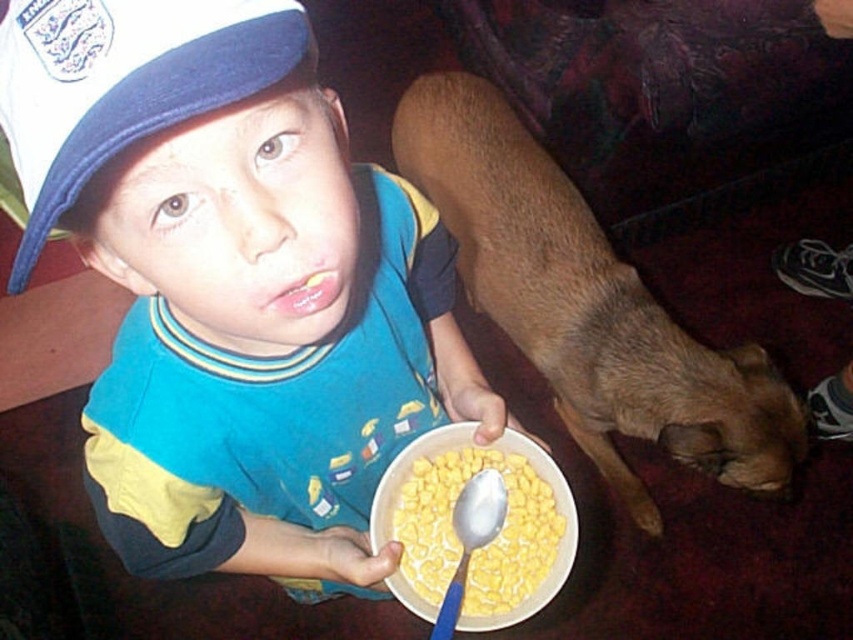
At what (x,y) coordinates should I click in order to perform the action: click on blue fabric baseball cap at upper left. Please return your answer as a coordinate pair (x, y). The height and width of the screenshot is (640, 853). Looking at the image, I should click on (123, 83).

Who is positioned more to the left, blue fabric baseball cap at upper left or blue plastic spoon at lower center?

blue fabric baseball cap at upper left is more to the left.

Locate an element on the screen. The width and height of the screenshot is (853, 640). blue fabric baseball cap at upper left is located at coordinates (123, 83).

Does blue fabric baseball cap at upper left lie behind yellow cornflakes at lower center?

No, blue fabric baseball cap at upper left is closer to the viewer.

Is blue fabric baseball cap at upper left shorter than yellow cornflakes at lower center?

Indeed, blue fabric baseball cap at upper left has a lesser height compared to yellow cornflakes at lower center.

What do you see at coordinates (123, 83) in the screenshot? I see `blue fabric baseball cap at upper left` at bounding box center [123, 83].

Locate an element on the screen. blue fabric baseball cap at upper left is located at coordinates (123, 83).

Measure the distance between blue cotton shirt at center and brown furry dog at lower right.

A distance of 25.01 inches exists between blue cotton shirt at center and brown furry dog at lower right.

You are a GUI agent. You are given a task and a screenshot of the screen. Output one action in this format:
    pyautogui.click(x=<x>, y=<y>)
    Task: Click on the blue cotton shirt at center
    
    Given the screenshot: What is the action you would take?
    coord(233,284)

I want to click on blue cotton shirt at center, so click(x=233, y=284).